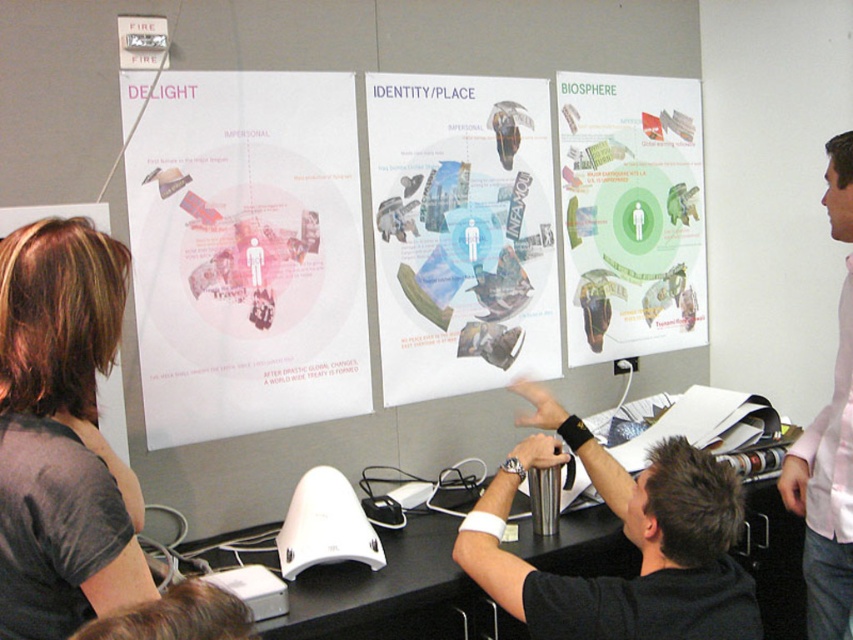
Question: Does white paper poster at upper left lie in front of matte paper poster at center?

Choices:
 (A) no
 (B) yes

Answer: (B)

Question: Estimate the real-world distances between objects in this image. Which object is farther from the dark gray shirt at left?

Choices:
 (A) green matte poster at upper right
 (B) metallic silver shaker at center
 (C) shiny brown hair at upper left

Answer: (A)

Question: Is green matte poster at upper right smaller than shiny brown hair at upper left?

Choices:
 (A) yes
 (B) no

Answer: (B)

Question: Can you confirm if matte paper poster at center is positioned to the right of black glossy table at center?

Choices:
 (A) no
 (B) yes

Answer: (B)

Question: Which point is farther from the camera taking this photo?

Choices:
 (A) (341, 605)
 (B) (427, 376)
 (C) (650, 154)

Answer: (C)

Question: Which of these objects is positioned closest to the metallic silver shaker at center?

Choices:
 (A) dark gray shirt at left
 (B) pink cotton shirt at right
 (C) shiny brown hair at upper left

Answer: (B)